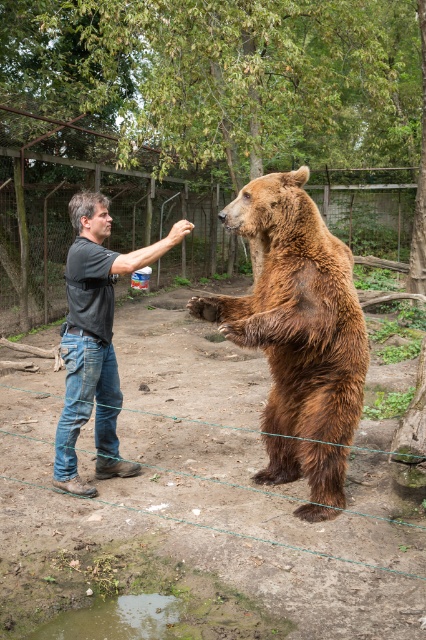
You are standing in the scene and want to toss a small ball to the bear. The ball is currently in your left hand. To ensure the ball goes over the metal wire fence at center and reaches the bear, which direction should you throw it relative to the jeans at center?

You should throw the ball to the right of the jeans at center because the metal wire fence at center is located to the right of the jeans at center, allowing the ball to go over the fence and reach the bear.

You are a wildlife photographer trying to capture a closeup shot of the brown furry bear at center. Your camera is set to focus on the point at coordinates 0.5, 0.7. Will the bear be in focus?

The brown furry bear at center is located at point (296, 310), which is very close to the camera focus point at (298, 320). The bear will be in focus.

You are a wildlife photographer observing the scene. You need to capture a photo where the brown furry bear at center is clearly visible above the jeans at center. Based on their positions, is this possible?

Yes, the brown furry bear at center is positioned over jeans at center, so capturing it clearly above the jeans at center is possible.